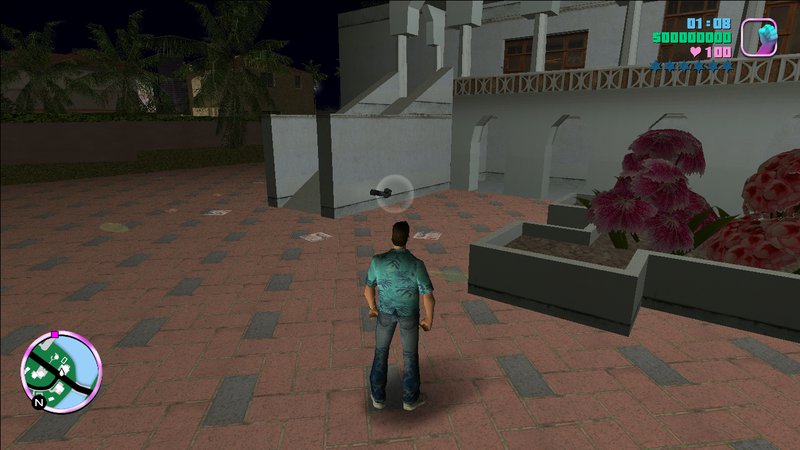
Locate an element on the screen. This screenshot has height=450, width=800. right archway is located at coordinates (666, 115).